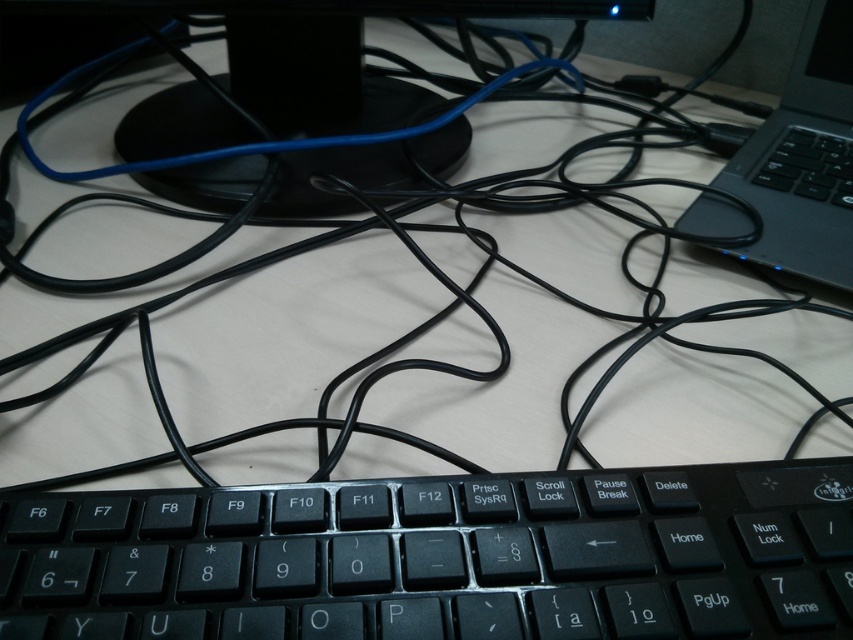
Measure the distance from black matte keyboard at center to black plastic laptop at right.

black matte keyboard at center is 15.06 inches away from black plastic laptop at right.

Is black matte keyboard at center closer to the viewer compared to black plastic laptop at right?

Yes, black matte keyboard at center is in front of black plastic laptop at right.

Is point (48, 593) farther from viewer compared to point (776, 168)?

That is False.

The image size is (853, 640). Identify the location of black matte keyboard at center. (444, 557).

Does black matte keyboard at center have a greater height compared to black plastic monitor at upper center?

Incorrect, black matte keyboard at center's height is not larger of black plastic monitor at upper center's.

What do you see at coordinates (444, 557) in the screenshot?
I see `black matte keyboard at center` at bounding box center [444, 557].

Who is more forward, (175,618) or (302,113)?

Point (175,618) is more forward.

The image size is (853, 640). In order to click on black matte keyboard at center in this screenshot , I will do `click(444, 557)`.

Does black plastic monitor at upper center have a lesser width compared to black plastic laptop at right?

Incorrect, black plastic monitor at upper center's width is not less than black plastic laptop at right's.

Who is positioned more to the left, black plastic monitor at upper center or black plastic laptop at right?

Positioned to the left is black plastic monitor at upper center.

Which is behind, point (227, 48) or point (816, 108)?

Point (227, 48)

Where is `black plastic monitor at upper center`? The height and width of the screenshot is (640, 853). black plastic monitor at upper center is located at coordinates (326, 52).